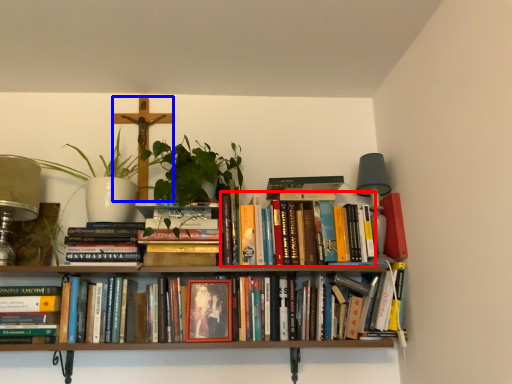
Question: Which object appears closest to the camera in this image, book (highlighted by a red box) or crucifix (highlighted by a blue box)?

Choices:
 (A) book
 (B) crucifix

Answer: (A)